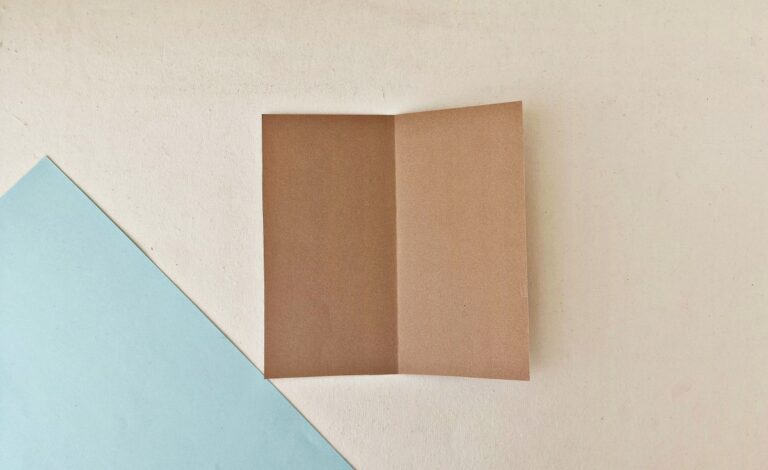
You are a GUI agent. You are given a task and a screenshot of the screen. Output one action in this format:
    pyautogui.click(x=<x>, y=<y>)
    Task: Click on the lighter part of table
    This screenshot has height=470, width=768.
    Given the screenshot: What is the action you would take?
    point(200,208)